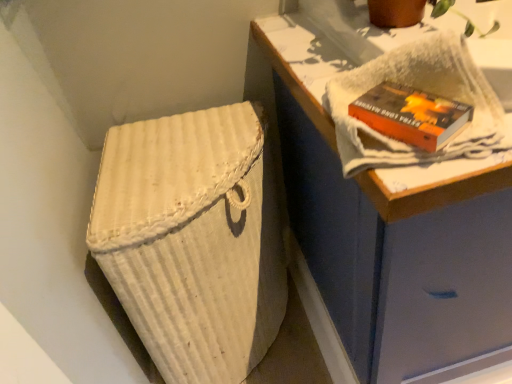
Question: Is white woven basket at lower left shorter than white woven laundry basket at lower left?

Choices:
 (A) no
 (B) yes

Answer: (A)

Question: Can you confirm if white woven basket at lower left is thinner than white woven laundry basket at lower left?

Choices:
 (A) no
 (B) yes

Answer: (A)

Question: Is white woven laundry basket at lower left located within white woven basket at lower left?

Choices:
 (A) no
 (B) yes

Answer: (A)

Question: From a real-world perspective, is white woven basket at lower left located beneath white woven laundry basket at lower left?

Choices:
 (A) yes
 (B) no

Answer: (B)

Question: Is white woven basket at lower left turned away from white woven laundry basket at lower left?

Choices:
 (A) no
 (B) yes

Answer: (A)

Question: Is white woven basket at lower left taller or shorter than orange matte paperback book at upper right?

Choices:
 (A) short
 (B) tall

Answer: (B)

Question: From a real-world perspective, relative to orange matte paperback book at upper right, is white woven basket at lower left vertically above or below?

Choices:
 (A) below
 (B) above

Answer: (A)

Question: From the image's perspective, is white woven basket at lower left located above or below orange matte paperback book at upper right?

Choices:
 (A) below
 (B) above

Answer: (A)

Question: In terms of width, does white woven basket at lower left look wider or thinner when compared to orange matte paperback book at upper right?

Choices:
 (A) wide
 (B) thin

Answer: (A)

Question: From their relative heights in the image, would you say white woven laundry basket at lower left is taller or shorter than white woven basket at lower left?

Choices:
 (A) short
 (B) tall

Answer: (A)

Question: From a real-world perspective, is white woven laundry basket at lower left above or below white woven basket at lower left?

Choices:
 (A) below
 (B) above

Answer: (A)

Question: Is white woven laundry basket at lower left spatially inside white woven basket at lower left, or outside of it?

Choices:
 (A) inside
 (B) outside

Answer: (B)

Question: Considering their positions, is white woven laundry basket at lower left located in front of or behind white woven basket at lower left?

Choices:
 (A) behind
 (B) front

Answer: (A)

Question: Would you say white woven laundry basket at lower left is inside or outside orange matte paperback book at upper right?

Choices:
 (A) outside
 (B) inside

Answer: (A)

Question: Is point (124, 152) positioned closer to the camera than point (441, 144)?

Choices:
 (A) farther
 (B) closer

Answer: (A)